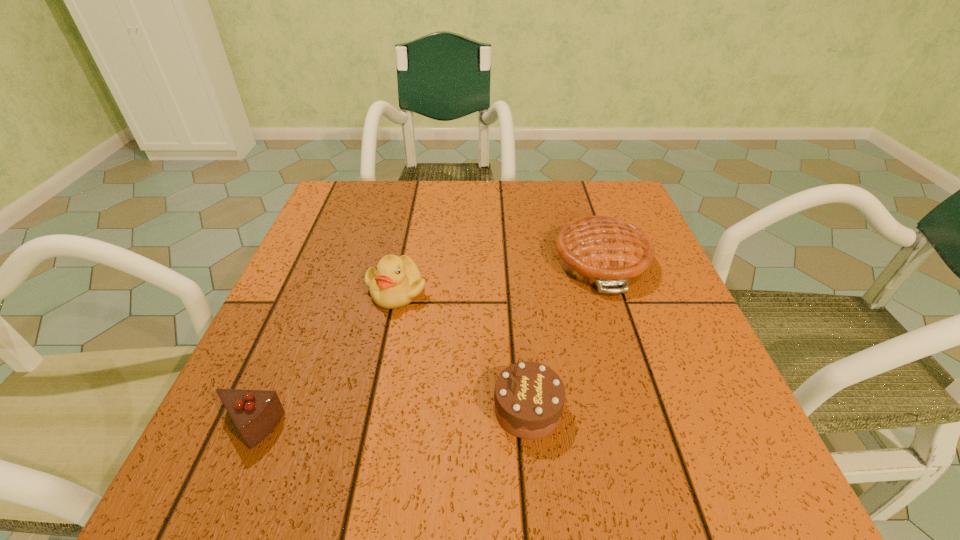
The image size is (960, 540). Find the location of `vacant area between the pie and the right chocolate cake`. vacant area between the pie and the right chocolate cake is located at coordinates (564, 335).

I want to click on empty space that is in between the duckling and the taller chocolate cake, so click(462, 349).

What are the coordinates of `object that stands as the second closest to the third object from right to left` in the screenshot? It's located at (255, 413).

This screenshot has height=540, width=960. In order to click on object that is the third closest to the third object from left to right in this screenshot , I will do `click(255, 413)`.

Locate an element on the screen. The height and width of the screenshot is (540, 960). free space in the image that satisfies the following two spatial constraints: 1. on the back side of the right chocolate cake; 2. on the left side of the leftmost object is located at coordinates (257, 409).

This screenshot has height=540, width=960. In order to click on vacant space that satisfies the following two spatial constraints: 1. on the back side of the right chocolate cake; 2. on the left side of the shortest object in this screenshot , I will do `click(257, 409)`.

Identify the location of vacant region that satisfies the following two spatial constraints: 1. at the face of the taller chocolate cake; 2. on the right side of the second object from left to right. (372, 409).